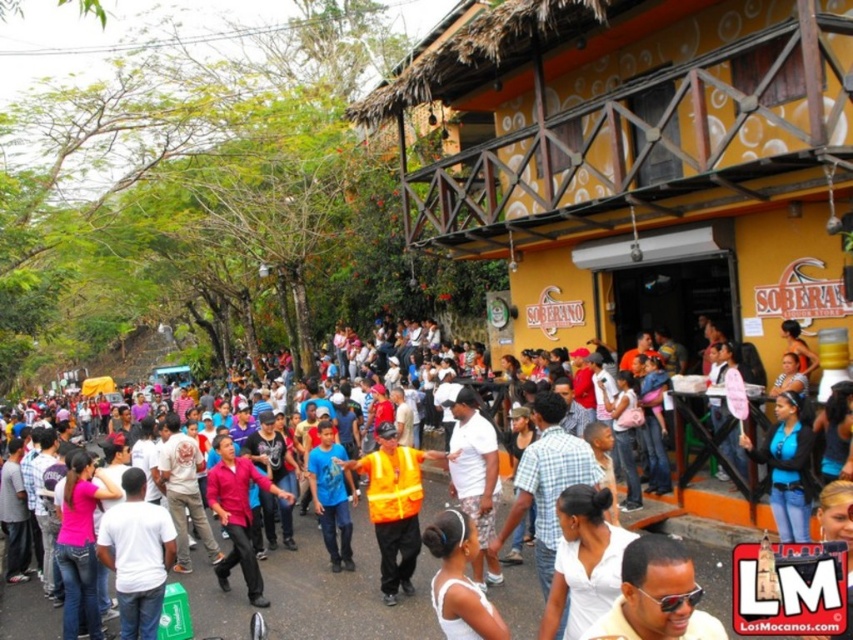
Question: Which of these objects is positioned farthest from the white matte tank top at center?

Choices:
 (A) matte pink shirt at center
 (B) high-visibility orange vest at center
 (C) orange reflective vest at center

Answer: (C)

Question: Does white matte tank top at center have a smaller size compared to matte pink shirt at center?

Choices:
 (A) yes
 (B) no

Answer: (A)

Question: Can you confirm if white matte shirt at center is wider than matte pink shirt at center?

Choices:
 (A) no
 (B) yes

Answer: (B)

Question: Which of the following is the farthest from the observer?

Choices:
 (A) (408, 624)
 (B) (453, 524)
 (C) (677, 579)
 (D) (393, 456)

Answer: (D)

Question: Can you confirm if white matte tank top at center is positioned above matte pink shirt at center?

Choices:
 (A) yes
 (B) no

Answer: (B)

Question: Which of the following is the closest to the observer?

Choices:
 (A) matte yellow shirt at center
 (B) high-visibility orange vest at center
 (C) white matte shirt at center

Answer: (A)